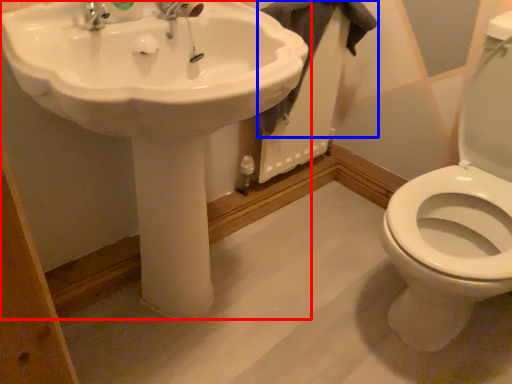
Question: Which object appears closest to the camera in this image, sink (highlighted by a red box) or bath towel (highlighted by a blue box)?

Choices:
 (A) sink
 (B) bath towel

Answer: (A)